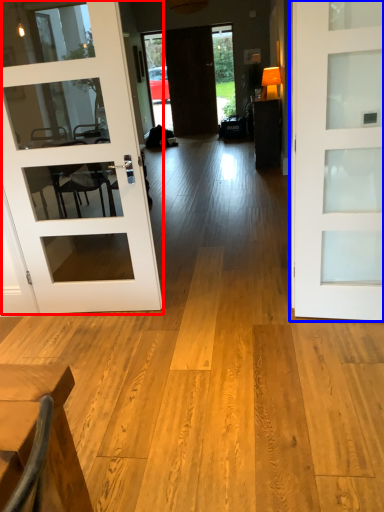
Question: Which object appears farthest to the camera in this image, door (highlighted by a red box) or door (highlighted by a blue box)?

Choices:
 (A) door
 (B) door

Answer: (A)